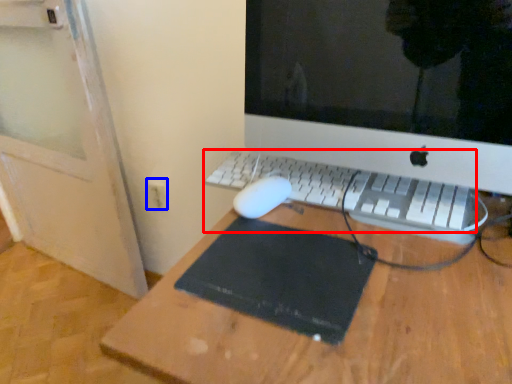
Question: Which of the following is the farthest to the observer, computer keyboard (highlighted by a red box) or electric outlet (highlighted by a blue box)?

Choices:
 (A) computer keyboard
 (B) electric outlet

Answer: (B)